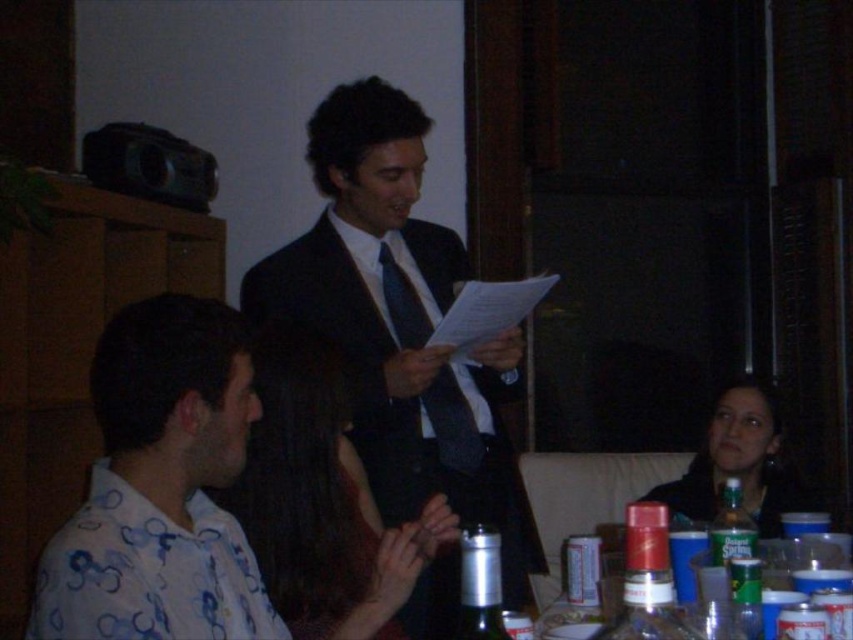
What are the coordinates of the smooth brown hair at center?

The smooth brown hair at center is located at point (x=305, y=486).

You are a photographer trying to capture a closeup of the metallic silver bottle at center without including the white printed shirt at left in the frame. Based on their positions, is this possible?

The white printed shirt at left is to the left of the metallic silver bottle at center, so if you position your camera to the right side of the bottle, you can capture the metallic silver bottle at center without including the white printed shirt at left in the frame.

You are a photographer trying to capture a clear photo of the matte black suit at center and the white printed shirt at left during the event. Based on their positions, which subject would you focus on first to ensure both are in frame?

The matte black suit at center is wider than the white printed shirt at left, so focusing on the matte black suit at center first would ensure both subjects are in frame since it occupies more space.